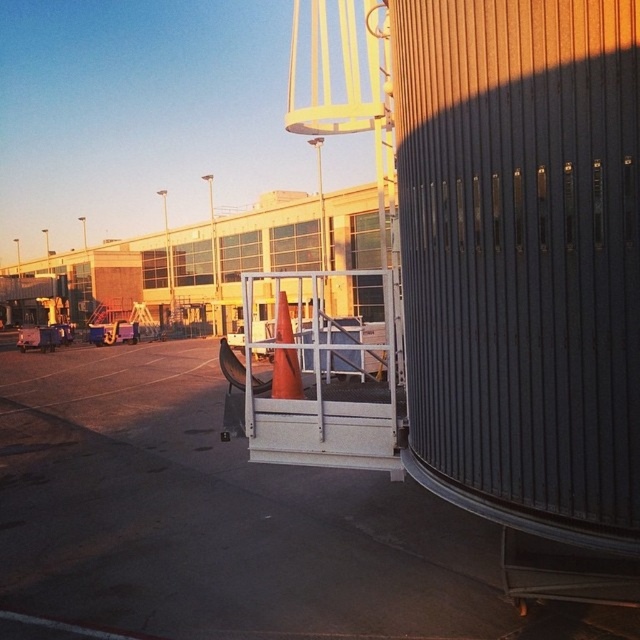
You are a construction worker who needs to place a new orange cone on the platform. The platform can only hold items that are shorter than the existing orange cone at center. Is the orange matte traffic cone at center suitable for placement?

The orange matte traffic cone at center is shorter than the orange cone at center, so it is suitable for placement on the platform.

You are standing at the point with coordinates point [278,352] and want to walk to the point point [72,438]. According to the scene, will the path be blocked by any structures?

Point point [72,438] is behind point point [278,352], so walking towards it would require moving behind the structure where you are standing, which might be blocked by the large cylindrical structure or its attached platform.